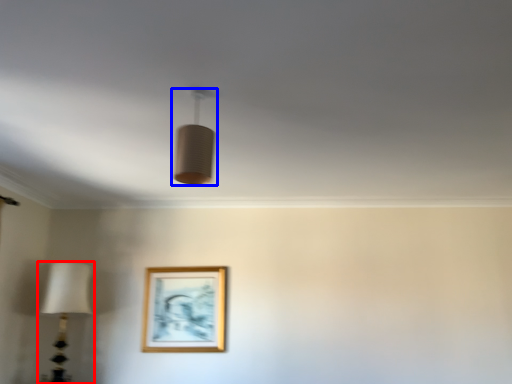
Question: Which of the following is the farthest to the observer, lamp (highlighted by a red box) or lamp (highlighted by a blue box)?

Choices:
 (A) lamp
 (B) lamp

Answer: (A)